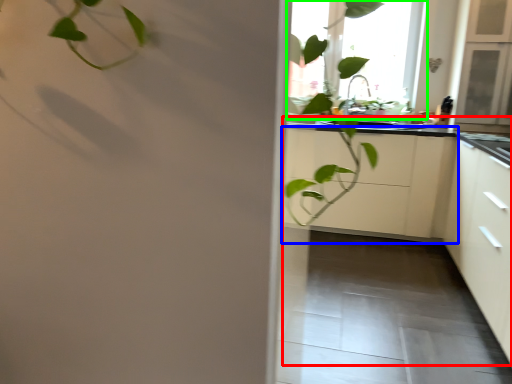
Question: Based on their relative distances, which object is nearer to counter top (highlighted by a red box)? Choose from cabinetry (highlighted by a blue box) and window (highlighted by a green box).

Choices:
 (A) cabinetry
 (B) window

Answer: (A)